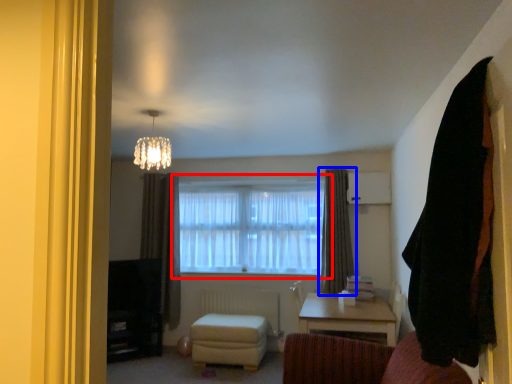
Question: Which object appears closest to the camera in this image, window (highlighted by a red box) or curtain (highlighted by a blue box)?

Choices:
 (A) window
 (B) curtain

Answer: (B)